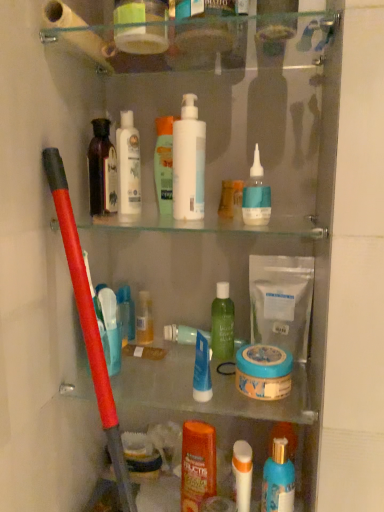
Question: Does point (251, 164) appear closer or farther from the camera than point (135, 168)?

Choices:
 (A) farther
 (B) closer

Answer: (B)

Question: Relative to white matte lotion at center, which ranks as the first cleaning product in left-to-right order, is blue matte bottle at upper right, the 2th cleaning product when ordered from right to left, in front or behind?

Choices:
 (A) front
 (B) behind

Answer: (A)

Question: Which of these objects is positioned farthest from the blue matte tube at center, the sixth toiletry when ordered from top to bottom?

Choices:
 (A) white matte lotion at center, which ranks as the first cleaning product in left-to-right order
 (B) blue matte bottle at upper right, the third cleaning product positioned from the left
 (C) white matte bag at center, which is the 4th cleaning product in left-to-right order
 (D) white matte toilet paper at upper left
 (E) translucent plastic bottle at center, which is the 4th toiletry in bottom-to-top order

Answer: (D)

Question: Which is farther from the translucent plastic bottle at center, which is the 4th toiletry in bottom-to-top order?

Choices:
 (A) blue matte bottle at upper right, the third cleaning product positioned from the left
 (B) blue glossy mouthwash at lower right, which is the 1th mouthwash in bottom-to-top order
 (C) green matte bottle at center, which is counted as the fourth toiletry, starting from the top
 (D) white matte lotion at center, which ranks as the first cleaning product in left-to-right order
 (E) orange matte shampoo at center, acting as the 2th toiletry starting from the bottom

Answer: (B)